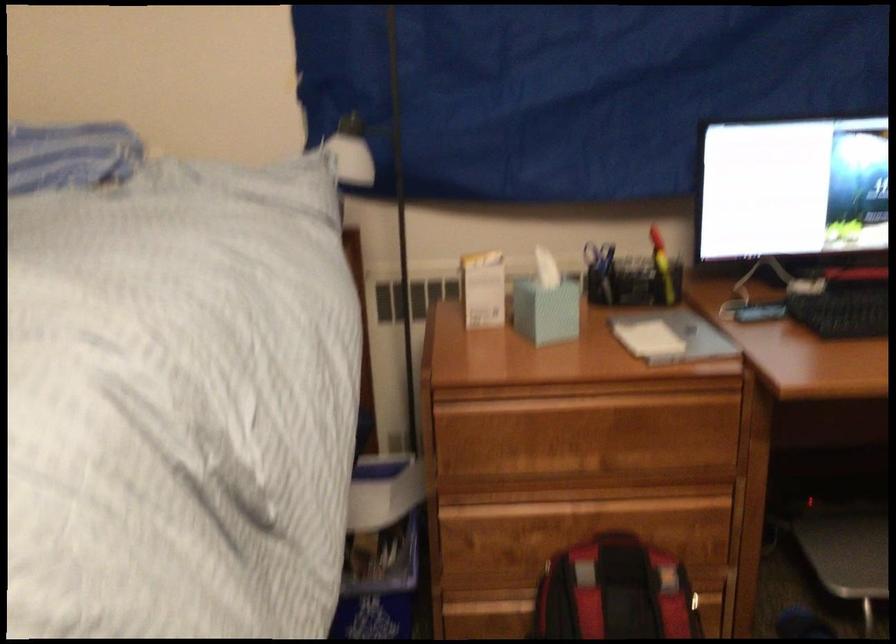
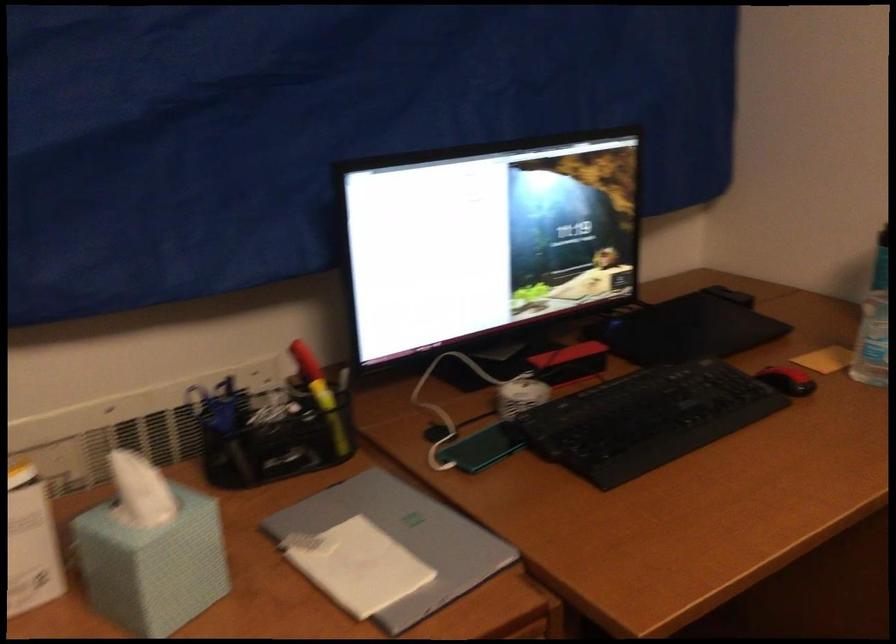
Question: The images are taken continuously from a first-person perspective. In which direction is your viewpoint rotating?

Choices:
 (A) Left
 (B) Right
 (C) Up
 (D) Down

Answer: (B)